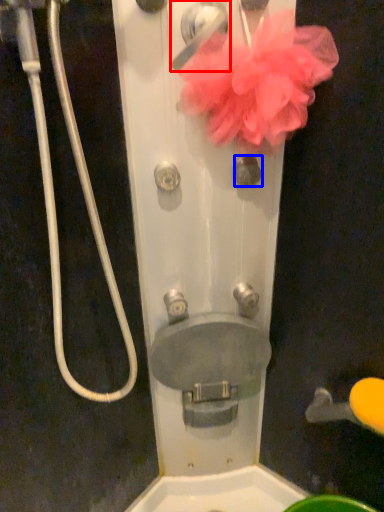
Question: Which of the following is the farthest to the observer, door handle (highlighted by a red box) or knob (highlighted by a blue box)?

Choices:
 (A) door handle
 (B) knob

Answer: (B)